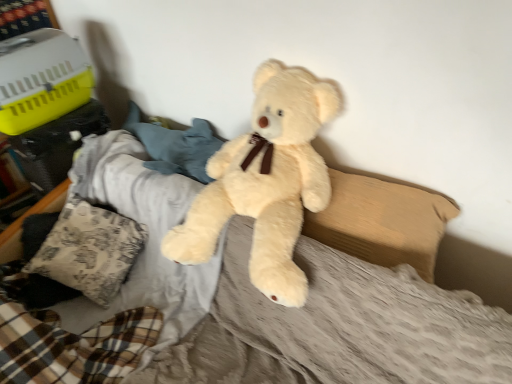
Question: Is fluffy beige teddy bear at center located outside patterned fabric pillow at lower left, marked as the 1th pillow in a left-to-right arrangement?

Choices:
 (A) no
 (B) yes

Answer: (B)

Question: Does fluffy beige teddy bear at center have a smaller size compared to patterned fabric pillow at lower left, marked as the 1th pillow in a left-to-right arrangement?

Choices:
 (A) no
 (B) yes

Answer: (A)

Question: From a real-world perspective, does fluffy beige teddy bear at center sit lower than patterned fabric pillow at lower left, marked as the 1th pillow in a left-to-right arrangement?

Choices:
 (A) yes
 (B) no

Answer: (B)

Question: Is fluffy beige teddy bear at center far from patterned fabric pillow at lower left, marked as the 1th pillow in a left-to-right arrangement?

Choices:
 (A) yes
 (B) no

Answer: (B)

Question: Considering the relative positions of fluffy beige teddy bear at center and patterned fabric pillow at lower left, which is the second pillow from right to left, in the image provided, is fluffy beige teddy bear at center to the left of patterned fabric pillow at lower left, which is the second pillow from right to left, from the viewer's perspective?

Choices:
 (A) yes
 (B) no

Answer: (B)

Question: From a real-world perspective, relative to patterned fabric pillow at lower left, which is the second pillow from right to left, is beige fabric pillow at center, placed as the 2th pillow when sorted from left to right, vertically above or below?

Choices:
 (A) above
 (B) below

Answer: (A)

Question: Choose the correct answer: Is beige fabric pillow at center, which is the 1th pillow from right to left, inside patterned fabric pillow at lower left, marked as the 1th pillow in a left-to-right arrangement, or outside it?

Choices:
 (A) inside
 (B) outside

Answer: (B)

Question: From their relative heights in the image, would you say beige fabric pillow at center, placed as the 2th pillow when sorted from left to right, is taller or shorter than patterned fabric pillow at lower left, which is the second pillow from right to left?

Choices:
 (A) tall
 (B) short

Answer: (B)

Question: In terms of size, does beige fabric pillow at center, placed as the 2th pillow when sorted from left to right, appear bigger or smaller than patterned fabric pillow at lower left, marked as the 1th pillow in a left-to-right arrangement?

Choices:
 (A) big
 (B) small

Answer: (B)

Question: Does point (187, 238) appear closer or farther from the camera than point (361, 254)?

Choices:
 (A) closer
 (B) farther

Answer: (B)

Question: From the image's perspective, is fluffy beige teddy bear at center positioned above or below beige fabric pillow at center, which is the 1th pillow from right to left?

Choices:
 (A) above
 (B) below

Answer: (A)

Question: Which is correct: fluffy beige teddy bear at center is inside beige fabric pillow at center, which is the 1th pillow from right to left, or outside of it?

Choices:
 (A) outside
 (B) inside

Answer: (A)

Question: Looking at their shapes, would you say fluffy beige teddy bear at center is wider or thinner than beige fabric pillow at center, which is the 1th pillow from right to left?

Choices:
 (A) wide
 (B) thin

Answer: (A)

Question: Is point (124, 216) closer or farther from the camera than point (324, 119)?

Choices:
 (A) closer
 (B) farther

Answer: (B)

Question: Is patterned fabric pillow at lower left, marked as the 1th pillow in a left-to-right arrangement, to the left or to the right of fluffy beige teddy bear at center in the image?

Choices:
 (A) right
 (B) left

Answer: (B)